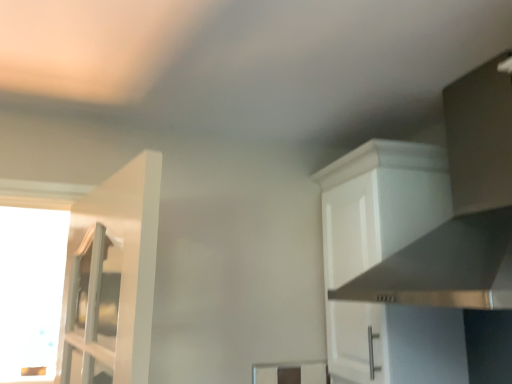
Question: From their relative heights in the image, would you say transparent glass window at left is taller or shorter than white matte cabinet at upper right?

Choices:
 (A) short
 (B) tall

Answer: (B)

Question: From the image's perspective, is transparent glass window at left above or below white matte cabinet at upper right?

Choices:
 (A) above
 (B) below

Answer: (B)

Question: Estimate the real-world distances between objects in this image. Which object is farther from the stainless steel vent at upper right?

Choices:
 (A) white matte cabinet at upper right
 (B) transparent glass window at left

Answer: (B)

Question: Which is nearer to the transparent glass window at left?

Choices:
 (A) white matte cabinet at upper right
 (B) stainless steel vent at upper right

Answer: (A)